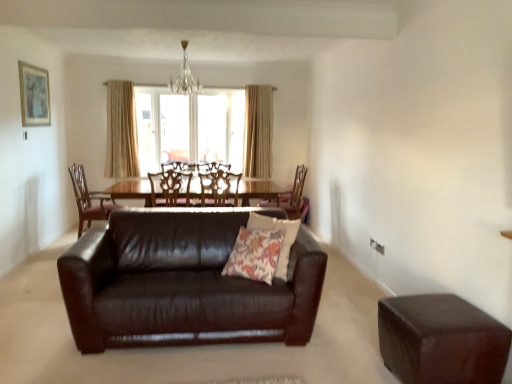
Question: Would you say floral fabric pillow at center is a long distance from beige fabric curtain at upper center, which ranks as the first curtain in left-to-right order?

Choices:
 (A) no
 (B) yes

Answer: (B)

Question: Can you confirm if floral fabric pillow at center is smaller than beige fabric curtain at upper center, which ranks as the first curtain in left-to-right order?

Choices:
 (A) no
 (B) yes

Answer: (B)

Question: Is floral fabric pillow at center positioned beyond the bounds of beige fabric curtain at upper center, which ranks as the first curtain in left-to-right order?

Choices:
 (A) no
 (B) yes

Answer: (B)

Question: Is floral fabric pillow at center shorter than beige fabric curtain at upper center, which ranks as the first curtain in left-to-right order?

Choices:
 (A) yes
 (B) no

Answer: (A)

Question: Is floral fabric pillow at center placed right next to beige fabric curtain at upper center, acting as the second curtain starting from the right?

Choices:
 (A) yes
 (B) no

Answer: (B)

Question: Considering the positions of wooden chair at center, which appears as the 2th chair when viewed from the right, and beige fabric curtain at upper center, which ranks as the first curtain in right-to-left order, in the image, is wooden chair at center, which appears as the 2th chair when viewed from the right, taller or shorter than beige fabric curtain at upper center, which ranks as the first curtain in right-to-left order,?

Choices:
 (A) tall
 (B) short

Answer: (B)

Question: From the image's perspective, is wooden chair at center, which appears as the 2th chair when viewed from the right, located above or below beige fabric curtain at upper center, which ranks as the first curtain in right-to-left order?

Choices:
 (A) above
 (B) below

Answer: (B)

Question: Is wooden chair at center, which appears as the 2th chair when viewed from the right, bigger or smaller than beige fabric curtain at upper center, the second curtain when ordered from left to right?

Choices:
 (A) big
 (B) small

Answer: (B)

Question: Considering the positions of wooden chair at center, the third chair from the left, and beige fabric curtain at upper center, the second curtain when ordered from left to right, in the image, is wooden chair at center, the third chair from the left, wider or thinner than beige fabric curtain at upper center, the second curtain when ordered from left to right,?

Choices:
 (A) thin
 (B) wide

Answer: (B)

Question: Considering their positions, is matte wooden picture frame at upper left located in front of or behind beige fabric curtain at upper center, acting as the second curtain starting from the right?

Choices:
 (A) front
 (B) behind

Answer: (A)

Question: Considering the relative positions of matte wooden picture frame at upper left and beige fabric curtain at upper center, which ranks as the first curtain in left-to-right order, in the image provided, is matte wooden picture frame at upper left to the left or to the right of beige fabric curtain at upper center, which ranks as the first curtain in left-to-right order,?

Choices:
 (A) right
 (B) left

Answer: (B)

Question: From a real-world perspective, is matte wooden picture frame at upper left physically located above or below beige fabric curtain at upper center, acting as the second curtain starting from the right?

Choices:
 (A) below
 (B) above

Answer: (B)

Question: Considering the positions of matte wooden picture frame at upper left and beige fabric curtain at upper center, which ranks as the first curtain in left-to-right order, in the image, is matte wooden picture frame at upper left taller or shorter than beige fabric curtain at upper center, which ranks as the first curtain in left-to-right order,?

Choices:
 (A) short
 (B) tall

Answer: (A)

Question: Is matte wooden picture frame at upper left wider or thinner than crystal glass chandelier at upper center?

Choices:
 (A) wide
 (B) thin

Answer: (B)

Question: Considering their positions, is matte wooden picture frame at upper left located in front of or behind crystal glass chandelier at upper center?

Choices:
 (A) behind
 (B) front

Answer: (B)